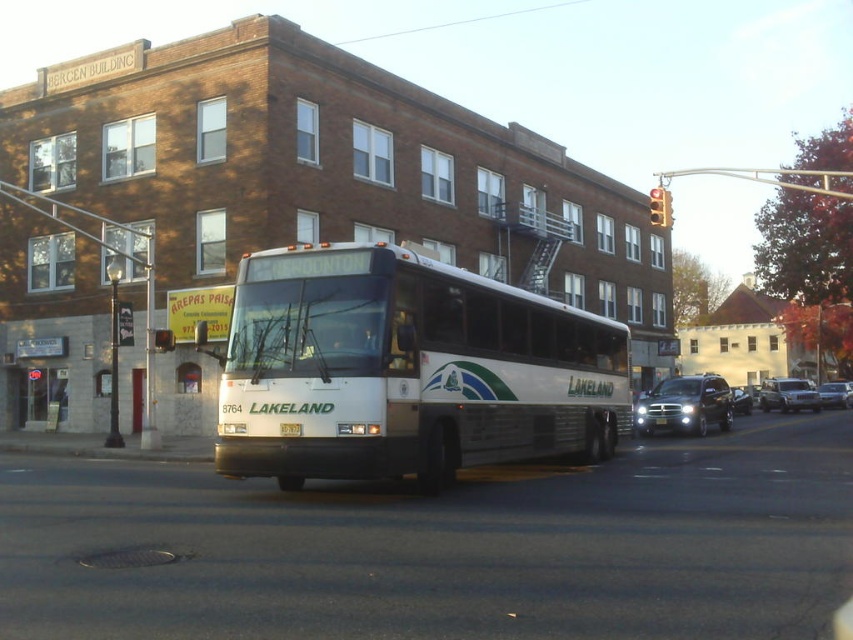
You are a pedestrian standing on the sidewalk and want to cross the street. You see a metallic traffic light at center and a white plastic license plate at center. Which object is closer to you?

The metallic traffic light at center is closer to you than the white plastic license plate at center.

You are a delivery driver who needs to park your 6 feet long truck between the satin black suv at center and the yellow metallic license plate at center. Is there enough space between them to park your truck?

The satin black suv at center and yellow metallic license plate at center are 6.22 feet apart. Since your truck is 6 feet long, there is enough space to park between them as the distance is slightly larger than the truck length.